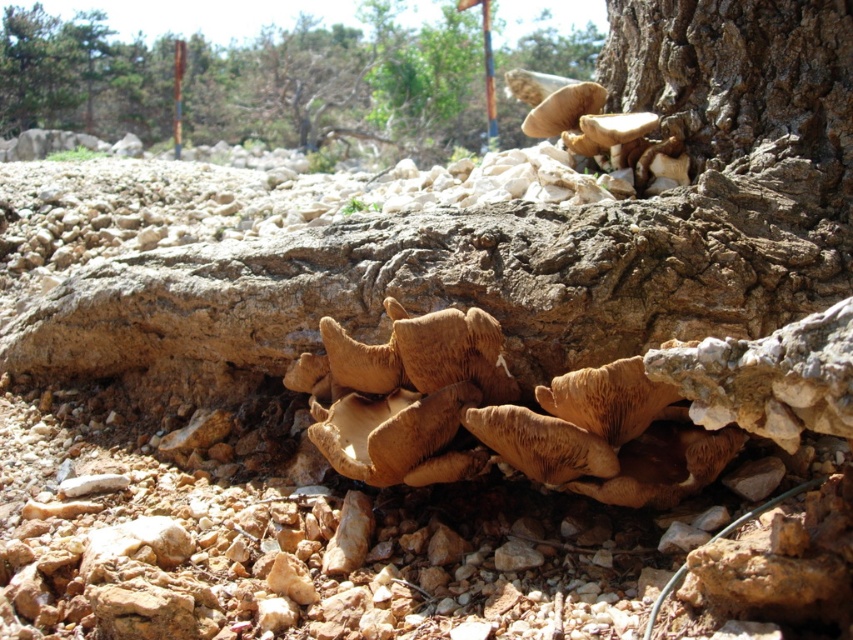
You are standing at the point marked by coordinates point (254, 81) in the image. Looking around, you see brown textured mushrooms at lower right. Which direction should you walk to reach the brown textured mushrooms at lower right?

Since you are already at the point marked by coordinates point (254, 81), which marks the location of the brown textured mushrooms at lower right, you are already at their location.